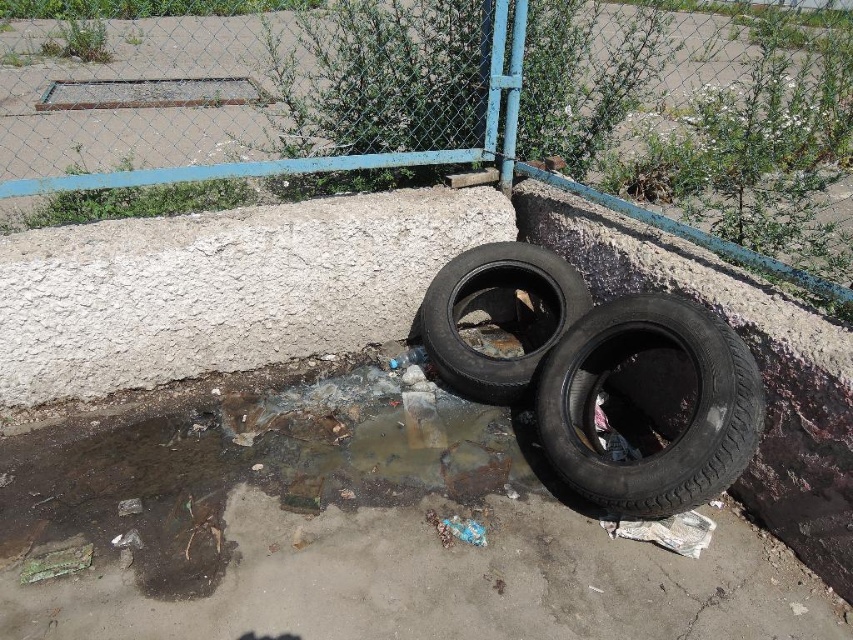
Is brown mud puddle at lower center closer to the viewer compared to black rubber tire at center?

Yes, it is in front of black rubber tire at center.

Describe the element at coordinates (380, 435) in the screenshot. This screenshot has height=640, width=853. I see `brown mud puddle at lower center` at that location.

Find the location of a particular element. The image size is (853, 640). brown mud puddle at lower center is located at coordinates (380, 435).

Who is taller, brown mud puddle at lower left or black rubber tire at lower right?

black rubber tire at lower right is taller.

What do you see at coordinates (241, 470) in the screenshot? Image resolution: width=853 pixels, height=640 pixels. I see `brown mud puddle at lower left` at bounding box center [241, 470].

Describe the element at coordinates (241, 470) in the screenshot. I see `brown mud puddle at lower left` at that location.

Where is `brown mud puddle at lower left`? This screenshot has height=640, width=853. brown mud puddle at lower left is located at coordinates (241, 470).

What do you see at coordinates (456, 106) in the screenshot? I see `rusty metal fence at upper center` at bounding box center [456, 106].

Does rusty metal fence at upper center have a greater height compared to black rubber tire at lower right?

Indeed, rusty metal fence at upper center has a greater height compared to black rubber tire at lower right.

Who is more distant from viewer, (x=830, y=163) or (x=619, y=477)?

The point (x=830, y=163) is behind.

I want to click on rusty metal fence at upper center, so click(x=456, y=106).